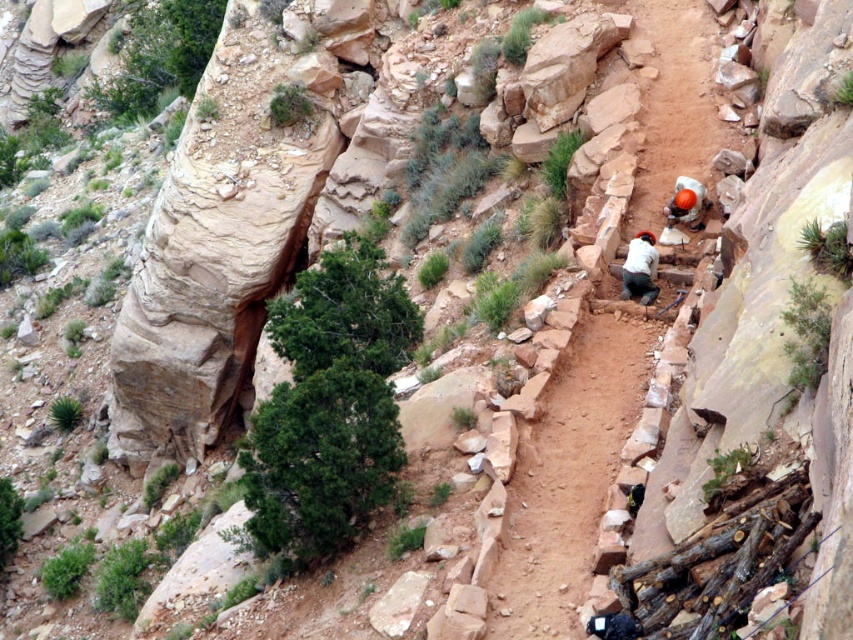
You are an archaeologist at the excavation site. You need to hand a tool to the person wearing the orange helmet at upper right. Which direction should you move relative to the white fabric shirt at center?

The white fabric shirt at center is to the left of the orange helmet at upper right, so you should move to the right relative to the white fabric shirt at center to reach the orange helmet at upper right.

You are an archaeologist at the excavation site. You need to transport a tool from the dirt trail at center to the orange helmet at upper right. Which object is larger in size to accommodate the tool?

The dirt trail at center is bigger than orange helmet at upper right, so the dirt trail at center can accommodate the tool better.

You are standing at the edge of the archaeological excavation trench. You notice two points marked on the rock wall in front of you. One is at coordinate point (642, 262) and the other at point (677, 205). Which point is closer to your current position?

Point (642, 262) is closer to the camera than point (677, 205), so the point at (642, 262) is closer to your current position.